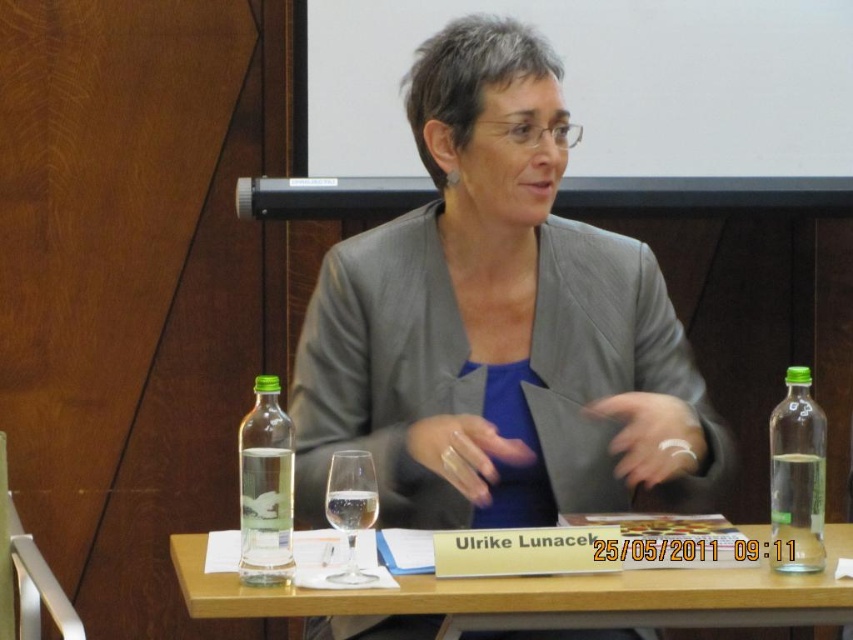
Question: Can you confirm if gray fabric jacket at center is bigger than clear glass wine glass at center?

Choices:
 (A) no
 (B) yes

Answer: (B)

Question: Which of the following is the closest to the observer?

Choices:
 (A) (291, 508)
 (B) (704, 600)
 (C) (619, 352)

Answer: (B)

Question: Which point is closer to the camera?

Choices:
 (A) wooden table at center
 (B) clear glass wine glass at center
 (C) gray fabric jacket at center

Answer: (A)

Question: Does gray fabric jacket at center have a smaller size compared to clear glass bottle at left?

Choices:
 (A) no
 (B) yes

Answer: (A)

Question: Estimate the real-world distances between objects in this image. Which object is farther from the clear glass bottle at right?

Choices:
 (A) gray fabric jacket at center
 (B) clear glass bottle at left
 (C) clear glass wine glass at center

Answer: (B)

Question: Can you confirm if wooden table at center is bigger than clear glass bottle at right?

Choices:
 (A) no
 (B) yes

Answer: (B)